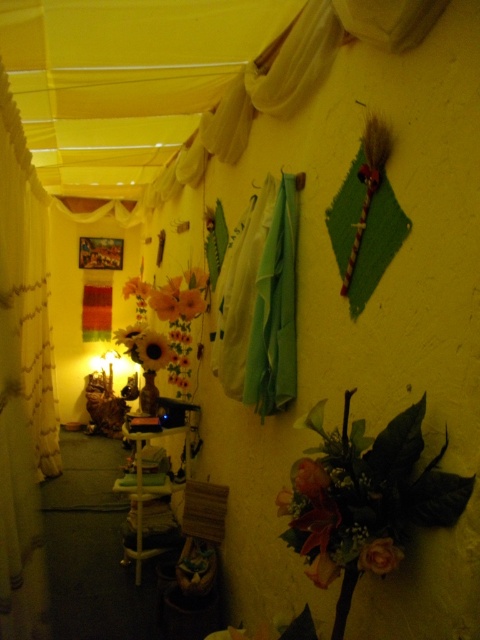
Who is more distant from viewer, (167, 307) or (325, 554)?

Positioned behind is point (167, 307).

Who is taller, sunflower vase at center or silky orange flower at lower right?

sunflower vase at center

You are a GUI agent. You are given a task and a screenshot of the screen. Output one action in this format:
    pyautogui.click(x=<x>, y=<y>)
    Task: Click on the sunflower vase at center
    
    Given the screenshot: What is the action you would take?
    pyautogui.click(x=168, y=323)

Is matte brown vase at center above silky orange flower at lower right?

Indeed, matte brown vase at center is positioned over silky orange flower at lower right.

Is point (152, 369) positioned before point (330, 579)?

No, it is behind (330, 579).

Is point (154, 356) farther from viewer compared to point (317, 557)?

That is True.

Find the location of a particular element. The width and height of the screenshot is (480, 640). matte brown vase at center is located at coordinates (152, 349).

Does white sheer curtain at left have a larger size compared to matte orange flower at lower right?

Indeed, white sheer curtain at left has a larger size compared to matte orange flower at lower right.

Is white sheer curtain at left below matte orange flower at lower right?

Incorrect, white sheer curtain at left is not positioned below matte orange flower at lower right.

Where is `white sheer curtain at left`? The image size is (480, 640). white sheer curtain at left is located at coordinates (23, 369).